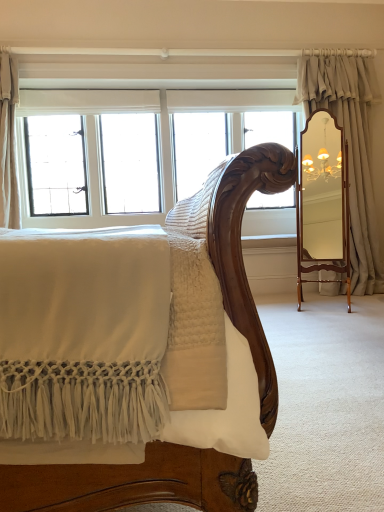
The image size is (384, 512). What do you see at coordinates (350, 148) in the screenshot? I see `satin beige curtain at right, placed as the second curtain when sorted from left to right` at bounding box center [350, 148].

At what (x,y) coordinates should I click in order to perform the action: click on white glass window at upper left. Please return your answer as a coordinate pair (x, y). This screenshot has height=512, width=384. Looking at the image, I should click on (131, 111).

The height and width of the screenshot is (512, 384). What are the coordinates of `beige linen curtain at upper left, which is the 1th curtain in left-to-right order` in the screenshot? It's located at click(x=8, y=143).

In order to face beige linen curtain at upper left, which is the 1th curtain in left-to-right order, should I rotate leftwards or rightwards?

To face it directly, rotate left by 23.861 degrees.

The image size is (384, 512). What are the coordinates of `satin beige curtain at right, placed as the second curtain when sorted from left to right` in the screenshot? It's located at (350, 148).

Which of these two, satin beige curtain at right, placed as the second curtain when sorted from left to right, or beige linen curtain at upper left, which is the 1th curtain in left-to-right order, stands shorter?

beige linen curtain at upper left, which is the 1th curtain in left-to-right order.

Which is nearer, (336, 286) or (7, 157)?

The point (7, 157) is more forward.

Can you tell me how much satin beige curtain at right, marked as the first curtain in a right-to-left arrangement, and beige linen curtain at upper left, which is the 1th curtain in left-to-right order, differ in facing direction?

The angle between the facing direction of satin beige curtain at right, marked as the first curtain in a right-to-left arrangement, and the facing direction of beige linen curtain at upper left, which is the 1th curtain in left-to-right order, is 90 degrees.

Is satin beige curtain at right, placed as the second curtain when sorted from left to right, with beige linen curtain at upper left, which is counted as the 2th curtain, starting from the right?

No, satin beige curtain at right, placed as the second curtain when sorted from left to right, is not in contact with beige linen curtain at upper left, which is counted as the 2th curtain, starting from the right.

Is point (17, 207) positioned behind point (66, 218)?

No, (17, 207) is closer to viewer.

Considering the relative sizes of beige linen curtain at upper left, which is counted as the 2th curtain, starting from the right, and white glass window at upper left in the image provided, is beige linen curtain at upper left, which is counted as the 2th curtain, starting from the right, shorter than white glass window at upper left?

Yes, beige linen curtain at upper left, which is counted as the 2th curtain, starting from the right, is shorter than white glass window at upper left.

From the picture: From the image's perspective, is beige linen curtain at upper left, which is the 1th curtain in left-to-right order, under white glass window at upper left?

No, from the image's perspective, beige linen curtain at upper left, which is the 1th curtain in left-to-right order, is not below white glass window at upper left.

Is white glass window at upper left facing towards beige linen curtain at upper left, which is counted as the 2th curtain, starting from the right?

Yes, white glass window at upper left is turned towards beige linen curtain at upper left, which is counted as the 2th curtain, starting from the right.

Can you confirm if white glass window at upper left is smaller than beige linen curtain at upper left, which is the 1th curtain in left-to-right order?

Actually, white glass window at upper left might be larger than beige linen curtain at upper left, which is the 1th curtain in left-to-right order.

Can you see white glass window at upper left touching beige linen curtain at upper left, which is the 1th curtain in left-to-right order?

They are not placed beside each other.

Is white glass window at upper left positioned beyond the bounds of beige linen curtain at upper left, which is the 1th curtain in left-to-right order?

white glass window at upper left is positioned outside beige linen curtain at upper left, which is the 1th curtain in left-to-right order.

Can we say satin beige curtain at right, placed as the second curtain when sorted from left to right, lies outside white glass window at upper left?

Indeed, satin beige curtain at right, placed as the second curtain when sorted from left to right, is completely outside white glass window at upper left.

Could you tell me if satin beige curtain at right, marked as the first curtain in a right-to-left arrangement, is turned towards white glass window at upper left?

No, satin beige curtain at right, marked as the first curtain in a right-to-left arrangement, is not turned towards white glass window at upper left.

Which is more to the right, satin beige curtain at right, placed as the second curtain when sorted from left to right, or white glass window at upper left?

satin beige curtain at right, placed as the second curtain when sorted from left to right, is more to the right.

What's the angular difference between satin beige curtain at right, marked as the first curtain in a right-to-left arrangement, and white glass window at upper left's facing directions?

The angle between the facing direction of satin beige curtain at right, marked as the first curtain in a right-to-left arrangement, and the facing direction of white glass window at upper left is 89.5 degrees.

Is satin beige curtain at right, placed as the second curtain when sorted from left to right, at the back of beige linen curtain at upper left, which is counted as the 2th curtain, starting from the right?

No.

Does point (10, 214) appear closer or farther from the camera than point (337, 77)?

Point (10, 214) is positioned closer to the camera compared to point (337, 77).

Is beige linen curtain at upper left, which is counted as the 2th curtain, starting from the right, bigger or smaller than satin beige curtain at right, placed as the second curtain when sorted from left to right?

Considering their sizes, beige linen curtain at upper left, which is counted as the 2th curtain, starting from the right, takes up less space than satin beige curtain at right, placed as the second curtain when sorted from left to right.

Would you say satin beige curtain at right, placed as the second curtain when sorted from left to right, is part of beige linen curtain at upper left, which is counted as the 2th curtain, starting from the right,'s contents?

No, satin beige curtain at right, placed as the second curtain when sorted from left to right, is not surrounded by beige linen curtain at upper left, which is counted as the 2th curtain, starting from the right.

Is white glass window at upper left bigger or smaller than satin beige curtain at right, marked as the first curtain in a right-to-left arrangement?

white glass window at upper left is bigger than satin beige curtain at right, marked as the first curtain in a right-to-left arrangement.

Is the surface of white glass window at upper left in direct contact with satin beige curtain at right, marked as the first curtain in a right-to-left arrangement?

white glass window at upper left and satin beige curtain at right, marked as the first curtain in a right-to-left arrangement, are clearly separated.

Which object is further away from the camera, white glass window at upper left or satin beige curtain at right, placed as the second curtain when sorted from left to right?

white glass window at upper left is further away from the camera.

Find the location of a particular element. Image resolution: width=384 pixels, height=512 pixels. curtain lying behind the beige linen curtain at upper left, which is counted as the 2th curtain, starting from the right is located at coordinates (350, 148).

You are a GUI agent. You are given a task and a screenshot of the screen. Output one action in this format:
    pyautogui.click(x=<x>, y=<y>)
    Task: Click on the curtain above the white glass window at upper left (from a real-world perspective)
    The image size is (384, 512).
    Given the screenshot: What is the action you would take?
    pyautogui.click(x=8, y=143)

From the image, which object appears to be nearer to satin beige curtain at right, placed as the second curtain when sorted from left to right, beige linen curtain at upper left, which is counted as the 2th curtain, starting from the right, or white glass window at upper left?

white glass window at upper left lies closer to satin beige curtain at right, placed as the second curtain when sorted from left to right, than the other object.

Looking at this image, looking at the image, which one is located closer to satin beige curtain at right, marked as the first curtain in a right-to-left arrangement, white glass window at upper left or beige linen curtain at upper left, which is counted as the 2th curtain, starting from the right?

white glass window at upper left lies closer to satin beige curtain at right, marked as the first curtain in a right-to-left arrangement, than the other object.

From the image, which object appears to be farther from white glass window at upper left, satin beige curtain at right, marked as the first curtain in a right-to-left arrangement, or beige linen curtain at upper left, which is the 1th curtain in left-to-right order?

Among the two, satin beige curtain at right, marked as the first curtain in a right-to-left arrangement, is located further to white glass window at upper left.

Considering their positions, is satin beige curtain at right, placed as the second curtain when sorted from left to right, positioned closer to beige linen curtain at upper left, which is counted as the 2th curtain, starting from the right, than white glass window at upper left?

white glass window at upper left.

Based on their spatial positions, is beige linen curtain at upper left, which is the 1th curtain in left-to-right order, or satin beige curtain at right, marked as the first curtain in a right-to-left arrangement, closer to white glass window at upper left?

beige linen curtain at upper left, which is the 1th curtain in left-to-right order, is positioned closer to the anchor white glass window at upper left.

Based on their spatial positions, is white glass window at upper left or satin beige curtain at right, placed as the second curtain when sorted from left to right, further from beige linen curtain at upper left, which is counted as the 2th curtain, starting from the right?

The object further to beige linen curtain at upper left, which is counted as the 2th curtain, starting from the right, is satin beige curtain at right, placed as the second curtain when sorted from left to right.

Find the location of a particular element. window situated between beige linen curtain at upper left, which is the 1th curtain in left-to-right order, and satin beige curtain at right, placed as the second curtain when sorted from left to right, from left to right is located at coordinates (131, 111).